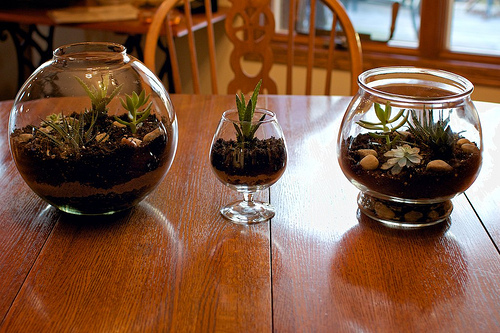
I want to click on table supports, so click(28, 49), click(166, 58).